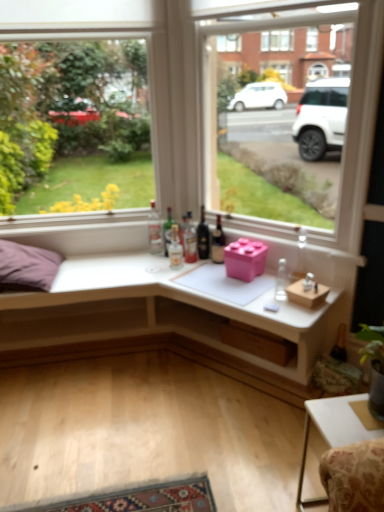
Where is `vacant space positioned to the left of pink matte plastic cube at center, positioned as the third window box in bottom-to-top order`? The width and height of the screenshot is (384, 512). vacant space positioned to the left of pink matte plastic cube at center, positioned as the third window box in bottom-to-top order is located at coordinates (207, 275).